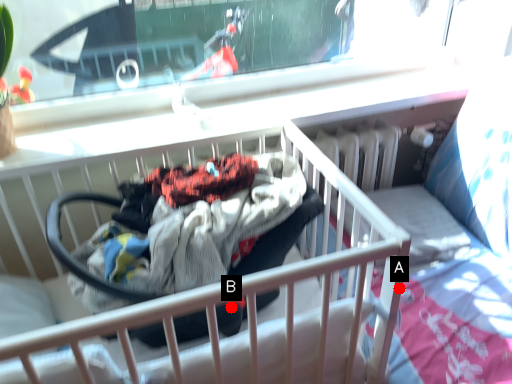
Question: Two points are circled on the image, labeled by A and B beside each circle. Which point is further to the camera?

Choices:
 (A) A is further
 (B) B is further

Answer: (A)